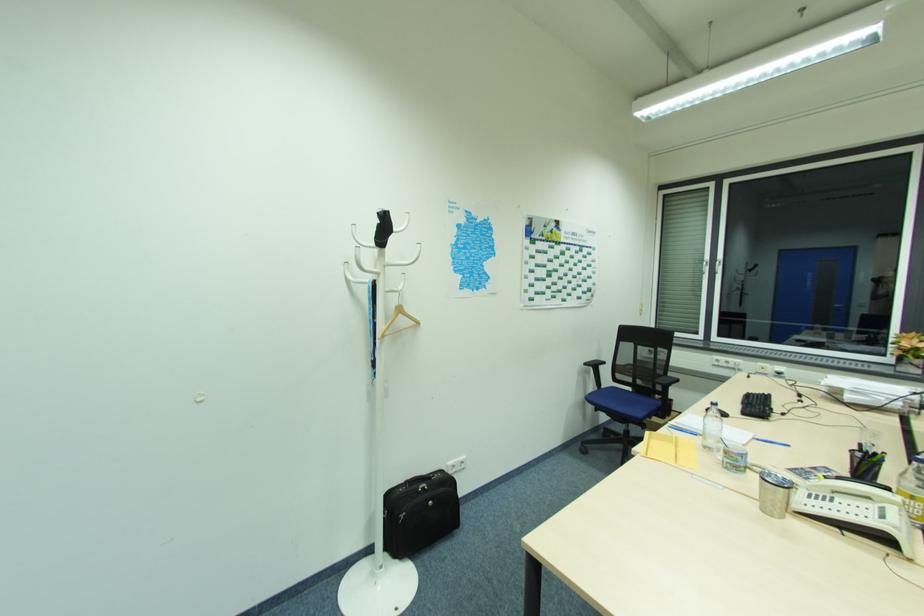
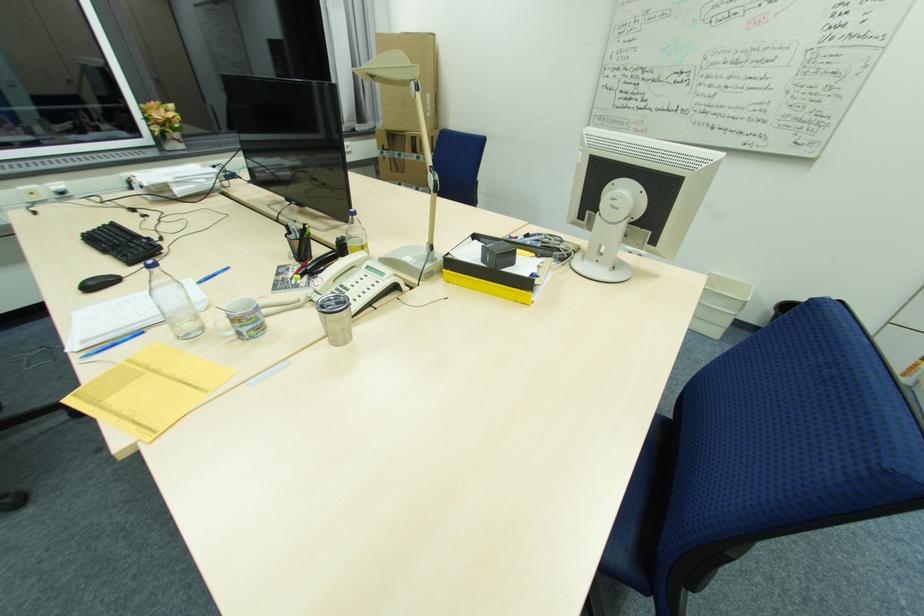
Where in the second image is the point corresponding to point (772, 395) from the first image?

(116, 224)